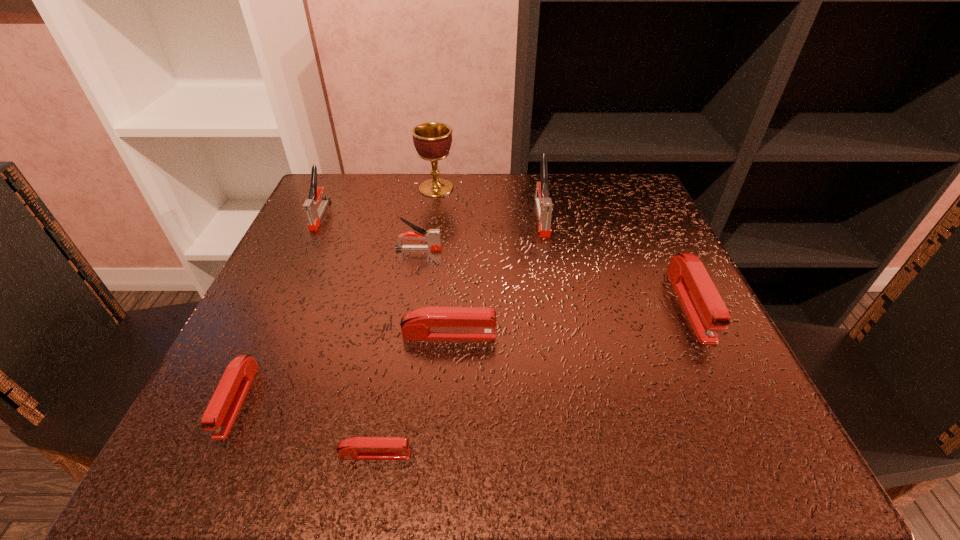
Identify which red stapler is located as the third nearest to the second shortest stapler. Please provide its 2D coordinates. Your answer should be formatted as a tuple, i.e. [(x, y)], where the tuple contains the x and y coordinates of a point satisfying the conditions above.

[(703, 305)]

This screenshot has height=540, width=960. Identify the location of vacant position in the image that satisfies the following two spatial constraints: 1. on the handle side of the tallest stapler; 2. on the front-facing side of the third smallest red stapler. tap(563, 335).

Find the location of `vacant area that satisfies the following two spatial constraints: 1. on the handle side of the nearest gray stapler; 2. on the front-facing side of the leftmost red stapler`. vacant area that satisfies the following two spatial constraints: 1. on the handle side of the nearest gray stapler; 2. on the front-facing side of the leftmost red stapler is located at coordinates (394, 400).

The height and width of the screenshot is (540, 960). What are the coordinates of `vacant space that satisfies the following two spatial constraints: 1. on the front-facing side of the biggest red stapler; 2. on the front-facing side of the shortest object` in the screenshot? It's located at (764, 454).

The height and width of the screenshot is (540, 960). I want to click on vacant region that satisfies the following two spatial constraints: 1. on the handle side of the fifth nearest stapler; 2. on the front-facing side of the second shortest object, so click(x=394, y=400).